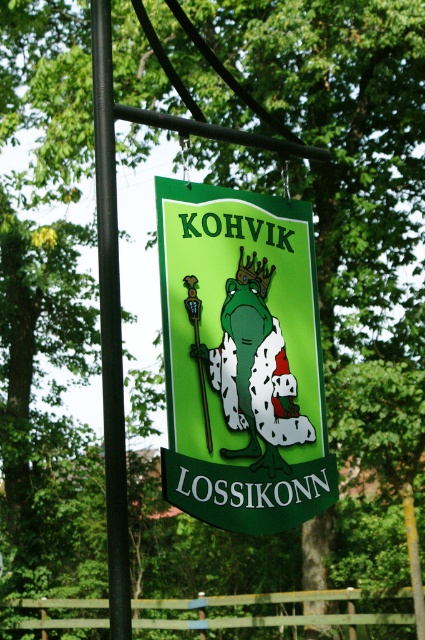
Looking at this image, can you confirm if green matte sign at center is wider than black metal pole at left?

Yes, green matte sign at center is wider than black metal pole at left.

Based on the photo, who is more forward, (243, 204) or (112, 451)?

Point (112, 451) is more forward.

Identify the location of green matte sign at center. (241, 358).